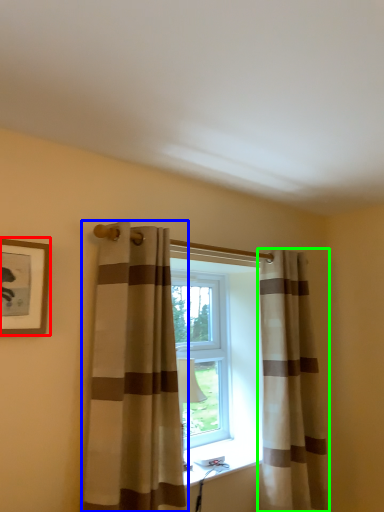
Question: Which object is positioned farthest from picture frame (highlighted by a red box)? Select from curtain (highlighted by a blue box) and curtain (highlighted by a green box).

Choices:
 (A) curtain
 (B) curtain

Answer: (B)